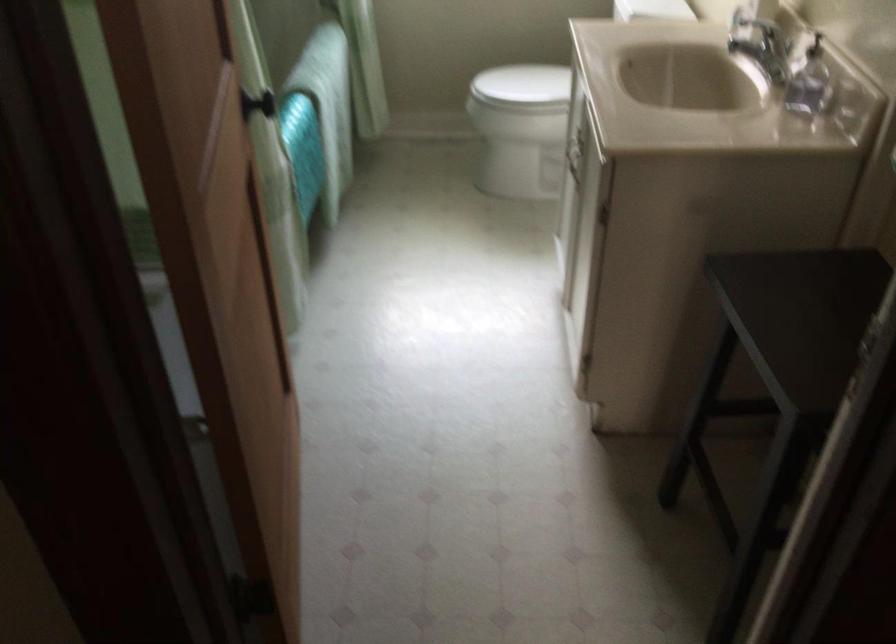
Identify the location of faucet handle. (748, 19).